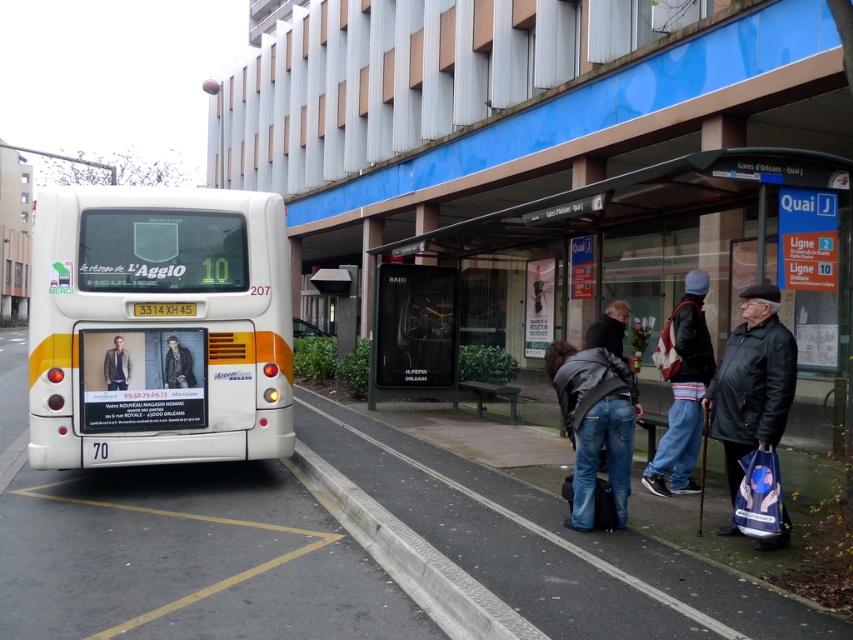
Question: Which of the following is the closest to the observer?

Choices:
 (A) (107, 349)
 (B) (695, 273)
 (C) (758, 371)

Answer: (C)

Question: Is white matte bus at left smaller than leather jacket at rear?

Choices:
 (A) no
 (B) yes

Answer: (A)

Question: Which object is positioned farthest from the white matte bus at left?

Choices:
 (A) black leather jacket at right
 (B) gray concrete curb at lower center
 (C) matte black jacket at center

Answer: (A)

Question: Is transparent glass shelter at center positioned before leather jacket at rear?

Choices:
 (A) no
 (B) yes

Answer: (B)

Question: Which object is the closest to the leather jacket at rear?

Choices:
 (A) leather jacket at center
 (B) black leather jacket at right
 (C) white matte bus at left

Answer: (C)

Question: Is denim pants at lower right to the right of matte black jacket at center from the viewer's perspective?

Choices:
 (A) no
 (B) yes

Answer: (B)